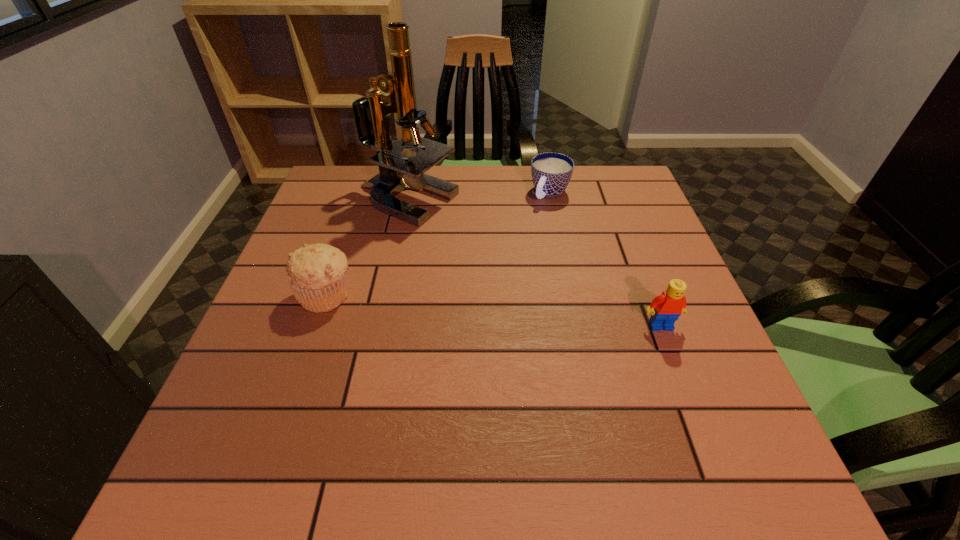
Where is `vacant space on the desktop that is between the second nearest object and the nearest object and is positioned on the side of the second object from right to left with the handle`? This screenshot has width=960, height=540. vacant space on the desktop that is between the second nearest object and the nearest object and is positioned on the side of the second object from right to left with the handle is located at coordinates (465, 307).

You are a GUI agent. You are given a task and a screenshot of the screen. Output one action in this format:
    pyautogui.click(x=<x>, y=<y>)
    Task: Click on the free space on the desktop that is between the second nearest object and the rightmost object and is positioned at the eyepiece of the microscope
    Image resolution: width=960 pixels, height=540 pixels.
    Given the screenshot: What is the action you would take?
    pyautogui.click(x=518, y=313)